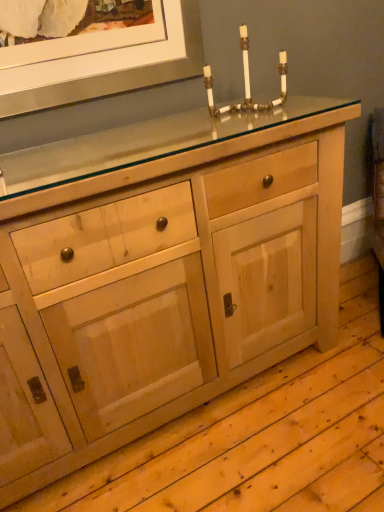
Find the location of a particular element. This screenshot has height=512, width=384. free space on the front side of white ceramic candle holder at upper center is located at coordinates (240, 131).